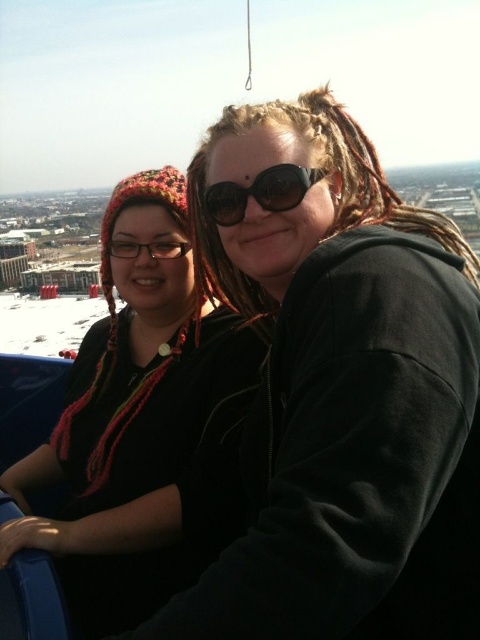
Question: Which point appears closest to the camera in this image?

Choices:
 (A) (467, 515)
 (B) (184, 200)
 (C) (299, 172)

Answer: (A)

Question: Observing the image, what is the correct spatial positioning of knitted wool hat at left in reference to black matte goggles at center?

Choices:
 (A) left
 (B) right

Answer: (A)

Question: Is black matte hoodie at center positioned behind black matte goggles at center?

Choices:
 (A) yes
 (B) no

Answer: (B)

Question: Which object appears farthest from the camera in this image?

Choices:
 (A) black matte hoodie at center
 (B) black matte goggles at center

Answer: (B)

Question: Which of the following is the closest to the observer?

Choices:
 (A) knitted wool hat at left
 (B) black matte goggles at center
 (C) black matte hoodie at center

Answer: (C)

Question: Is knitted wool hat at left below black matte goggles at center?

Choices:
 (A) yes
 (B) no

Answer: (A)